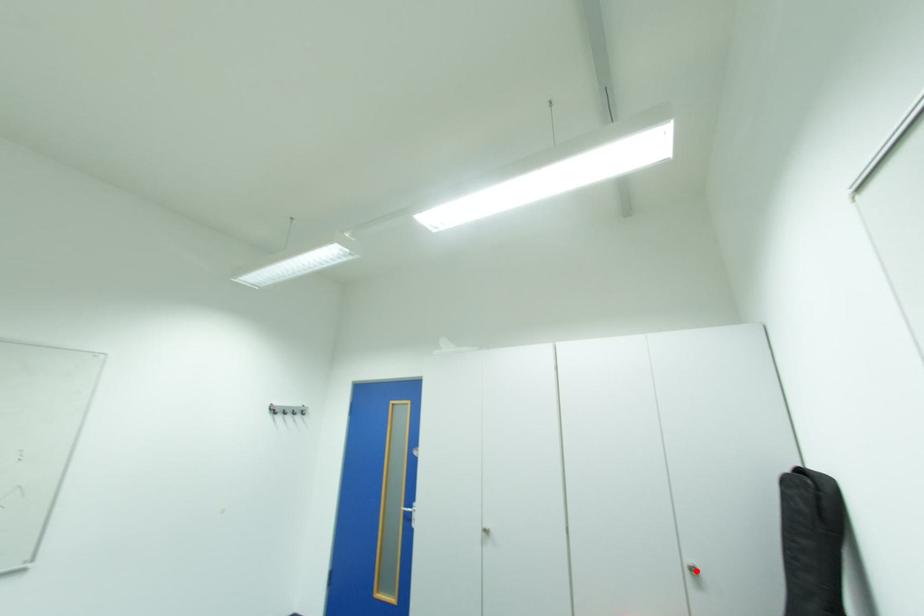
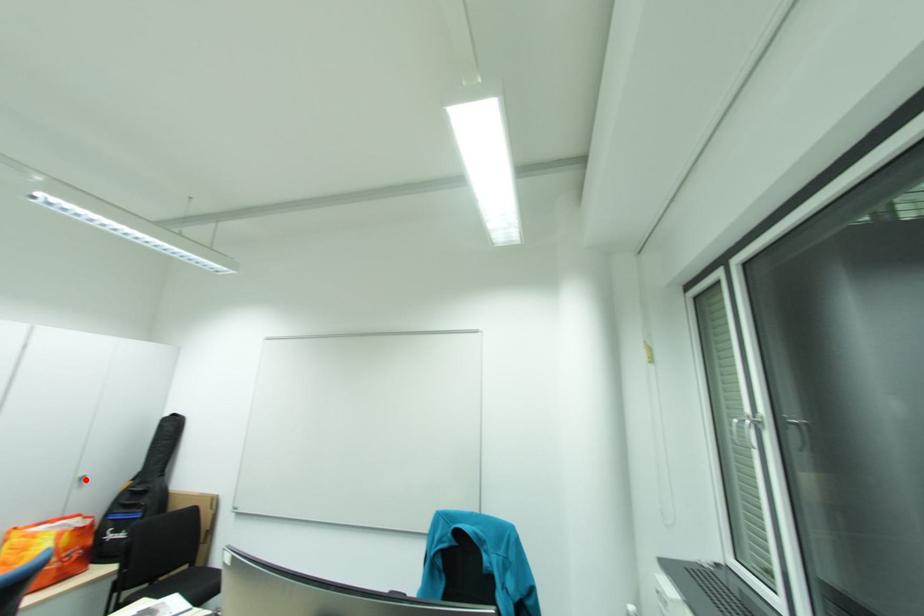
I am providing you with two images of the same scene from different viewpoints. A red point is marked on the first image and another point is marked on the second image. Does the point marked in image1 correspond to the same location as the one in image2?

Yes